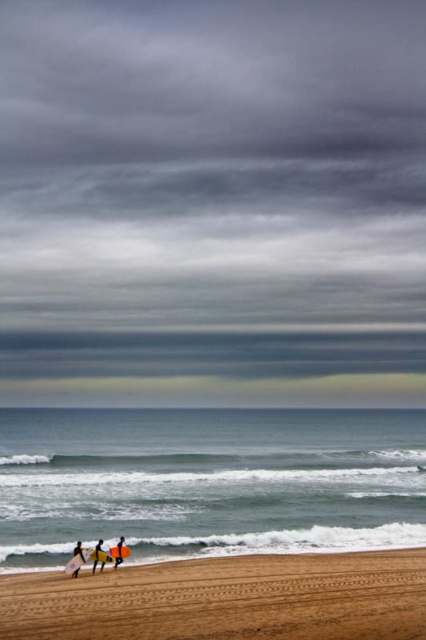
You are a photographer planning to capture the yellow fabric surfboard at lower left against the dramatic backdrop of the gray cloudy sky at upper center. Based on the scene, can you confirm if the surfboard will be positioned below the sky in the image?

Yes, the gray cloudy sky at upper center is located above the yellow fabric surfboard at lower left, so the surfboard will be positioned below the sky in the image.

You are standing on the beach and see two points marked on the sand. The first point is labeled as point (95,202) and the second is point (103,563). Which point is closer to you?

Point (95,202) is closer to you because it is further to the viewer than point (103,563).

You are a photographer trying to capture a wide shot of the beach scene. The brown sandy beach at lower center and the yellow foam surfboard at lower center are both in your frame. Since you want to emphasize the vastness of the beach, which object should you focus on and why?

You should focus on the brown sandy beach at lower center because it has a larger size compared to the yellow foam surfboard at lower center, which will help emphasize the vastness of the beach.